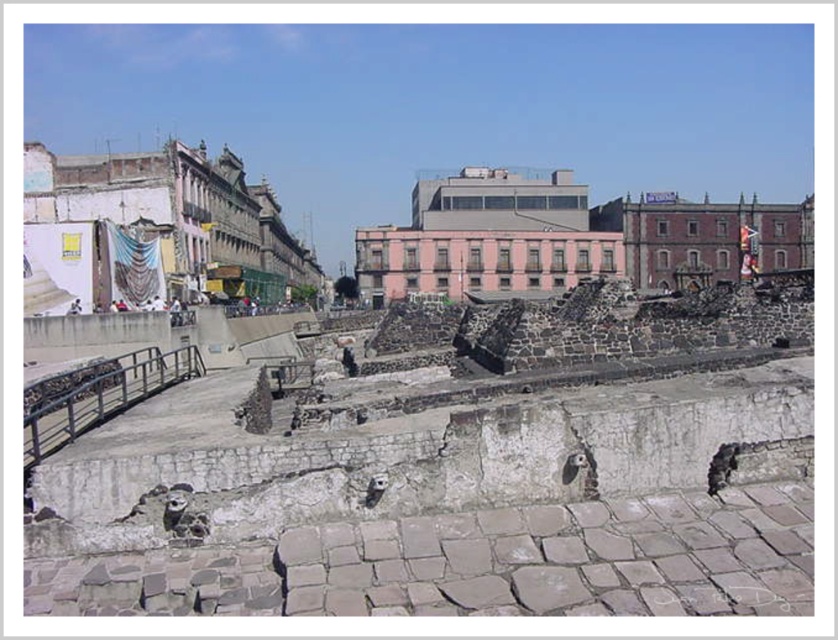
Question: Can you confirm if pink concrete ruins at center is positioned to the left of red brick ruins at center?

Choices:
 (A) no
 (B) yes

Answer: (B)

Question: Is red brick ruins at center further to camera compared to white fabric at upper center?

Choices:
 (A) no
 (B) yes

Answer: (B)

Question: Is white stone ruins at left below pink concrete ruins at center?

Choices:
 (A) no
 (B) yes

Answer: (B)

Question: Which of the following is the farthest from the observer?

Choices:
 (A) pink concrete ruins at center
 (B) red brick ruins at center

Answer: (B)

Question: Which object appears closest to the camera in this image?

Choices:
 (A) white fabric at upper center
 (B) white stone ruins at left

Answer: (B)

Question: Which object appears closest to the camera in this image?

Choices:
 (A) red brick ruins at center
 (B) white fabric at upper center

Answer: (B)